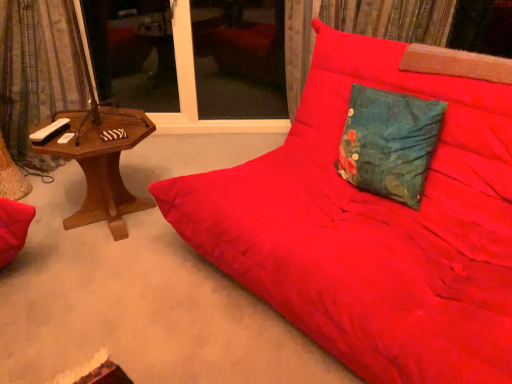
Question: Considering their positions, is transparent glass window at center, which is counted as the 2th window screen, starting from the left, located in front of or behind teal floral fabric pillow at center?

Choices:
 (A) behind
 (B) front

Answer: (A)

Question: From the image's perspective, is transparent glass window at center, which is counted as the 2th window screen, starting from the left, positioned above or below teal floral fabric pillow at center?

Choices:
 (A) below
 (B) above

Answer: (B)

Question: Based on their relative distances, which object is farther from the velvet-like curtain at left?

Choices:
 (A) transparent glass window at upper center, the first window screen from the left
 (B) transparent glass window at center, which is counted as the 2th window screen, starting from the left
 (C) woodenmaterial/texturetable at left
 (D) teal floral fabric pillow at center
 (E) matte red fabric studio couch at center

Answer: (D)

Question: Which object is positioned closest to the velvet-like curtain at left?

Choices:
 (A) woodenmaterial/texturetable at left
 (B) teal floral fabric pillow at center
 (C) transparent glass window at upper center, which appears as the second window screen when viewed from the right
 (D) transparent glass window at center, which is counted as the 2th window screen, starting from the left
 (E) matte red fabric studio couch at center

Answer: (A)